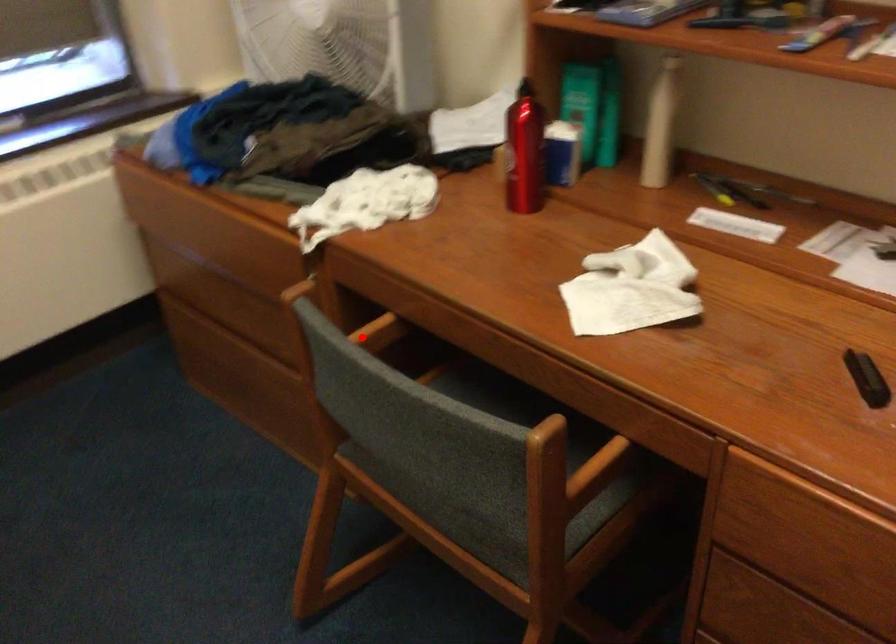
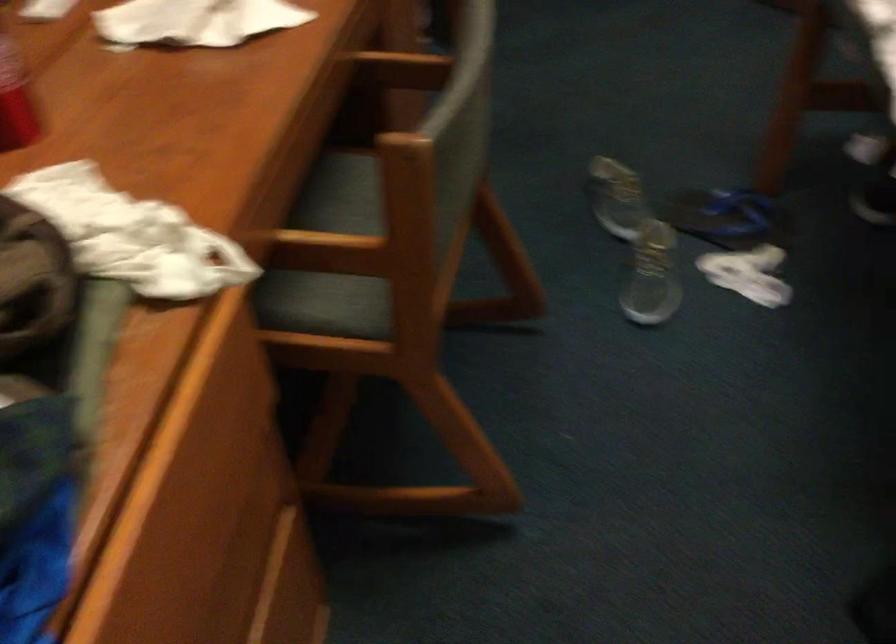
Question: I am providing you with two images of the same scene from different viewpoints. A red point is shown in image1. For the corresponding object point in image2, is it positioned nearer or farther from the camera?

Choices:
 (A) Nearer
 (B) Farther

Answer: (A)